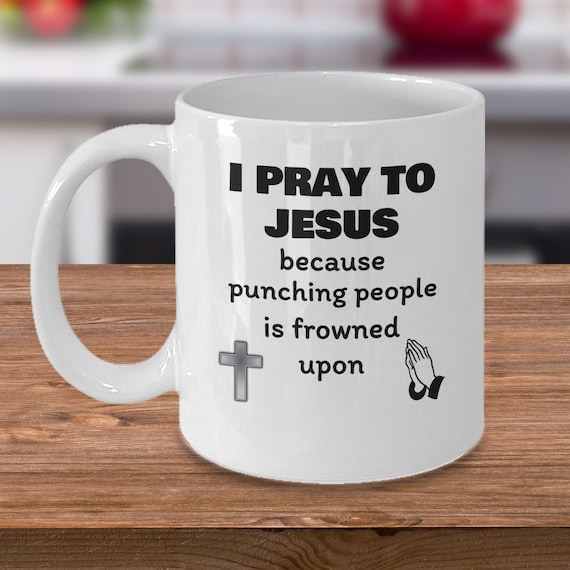
The height and width of the screenshot is (570, 570). Identify the location of the top lip of cup, center. (209, 101), (422, 114), (327, 73).